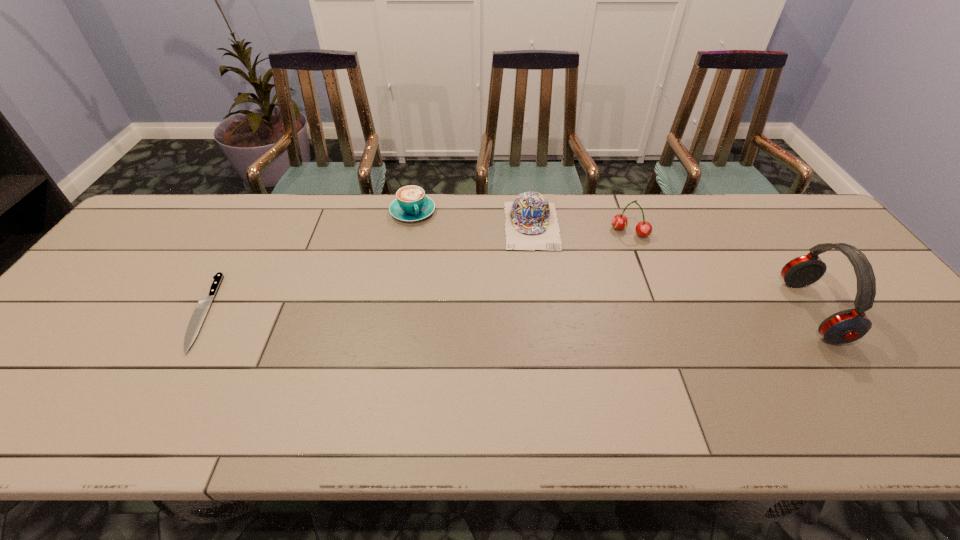
The height and width of the screenshot is (540, 960). Find the location of `vacant space located with stems pointing upwards on the cherry`. vacant space located with stems pointing upwards on the cherry is located at coordinates (617, 252).

Identify the location of free location located 0.250m with stems pointing upwards on the cherry. (595, 293).

Image resolution: width=960 pixels, height=540 pixels. I want to click on free space located 0.350m with stems pointing upwards on the cherry, so click(x=582, y=319).

Find the location of a particular element. Image resolution: width=960 pixels, height=540 pixels. vacant position located 0.290m with the handle on the right side of the second object from left to right is located at coordinates (450, 288).

The width and height of the screenshot is (960, 540). Identify the location of vacant area situated with the handle on the right side of the second object from left to right. (431, 249).

Identify the location of vacant space positioned with the handle on the right side of the second object from left to right. point(444,276).

Find the location of `vacant region located 0.360m on the front, side, and top of the third object from left to right`. vacant region located 0.360m on the front, side, and top of the third object from left to right is located at coordinates (545, 356).

I want to click on free space located 0.340m on the front, side, and top of the third object from left to right, so click(544, 349).

Identify the location of free point located 0.400m on the front, side, and top of the third object from left to right. This screenshot has height=540, width=960. pos(547,371).

At what (x,y) coordinates should I click in order to perform the action: click on cherry that is at the far edge. Please return your answer as a coordinate pair (x, y). Looking at the image, I should click on (619, 221).